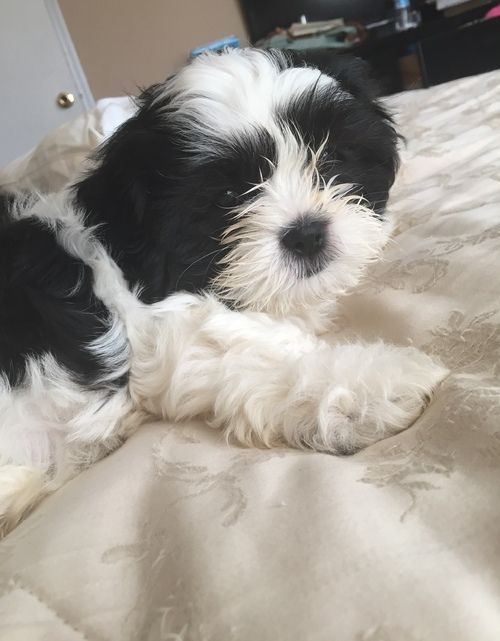
Locate an element on the screen. The image size is (500, 641). knob is located at coordinates (59, 103).